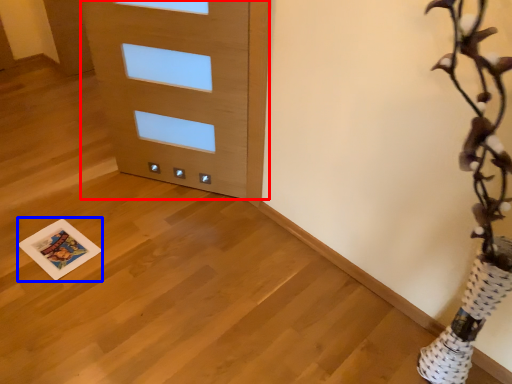
Question: Which object appears farthest to the camera in this image, door (highlighted by a red box) or print (highlighted by a blue box)?

Choices:
 (A) door
 (B) print

Answer: (B)